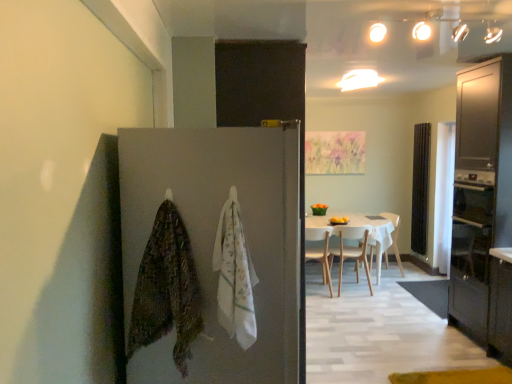
Identify the location of empty space that is ontop of black wood screen door at right. (424, 120).